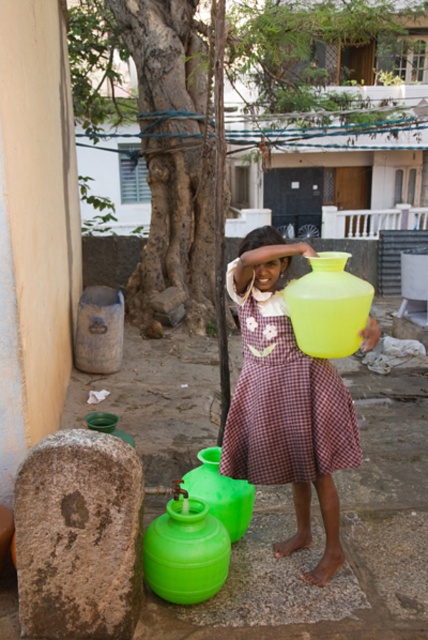
Consider the image. The young girl is standing with her brown checkered dress at center and matte brown hair at center. Which of these is positioned lower on her body?

The brown checkered dress at center is positioned lower on her body than the matte brown hair at center.

The young girl in the image is wearing a brown checkered dress at center and has matte brown hair at center. Which of these two items is wider?

The brown checkered dress at center is wider than the matte brown hair at center.

The young girl in the image is wearing a brown checkered dress at center and has matte brown hair at center. Which of these is taller?

The brown checkered dress at center is much taller than the matte brown hair at center.